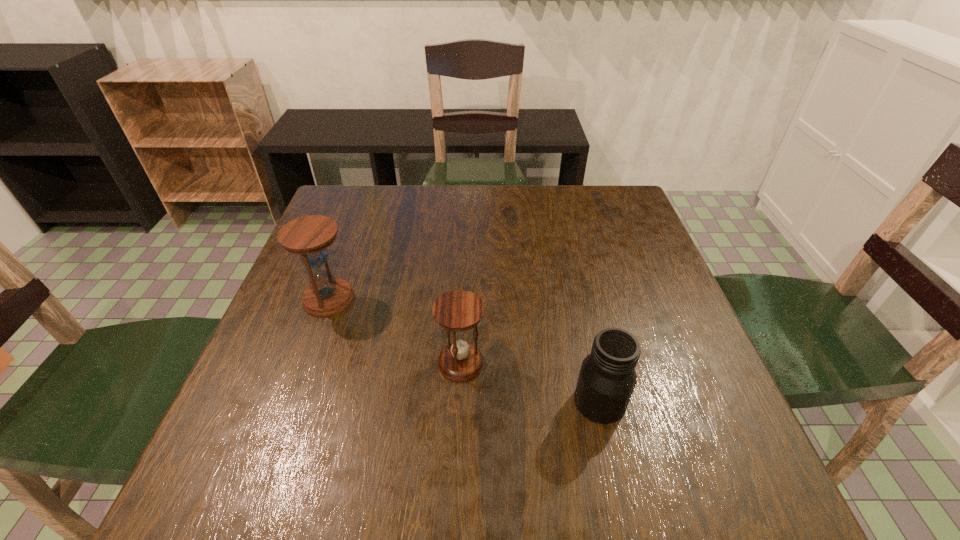
Where is `vacant space at the left edge of the desktop`? The image size is (960, 540). vacant space at the left edge of the desktop is located at coordinates (261, 353).

Locate an element on the screen. The image size is (960, 540). vacant area at the right edge of the desktop is located at coordinates (601, 278).

In the image, there is a desktop. Identify the location of free space at the far left corner. (375, 192).

At what (x,y) coordinates should I click in order to perform the action: click on free region at the far right corner of the desktop. Please return your answer as a coordinate pair (x, y). Looking at the image, I should click on coord(642,227).

At what (x,y) coordinates should I click in order to perform the action: click on unoccupied position between the second object from left to right and the farthest object. Please return your answer as a coordinate pair (x, y). The image size is (960, 540). Looking at the image, I should click on (395, 331).

This screenshot has width=960, height=540. Find the location of `free space between the second object from right to left and the farthest object`. free space between the second object from right to left and the farthest object is located at coordinates (395, 331).

Where is `unoccupied area between the leftmost object and the shorter hourglass`? Image resolution: width=960 pixels, height=540 pixels. unoccupied area between the leftmost object and the shorter hourglass is located at coordinates (395, 331).

The image size is (960, 540). What are the coordinates of `blank region between the jar and the shorter hourglass` in the screenshot? It's located at (530, 382).

I want to click on vacant space that's between the jar and the right hourglass, so click(530, 382).

At what (x,y) coordinates should I click in order to perform the action: click on vacant space in between the shorter hourglass and the leftmost object. Please return your answer as a coordinate pair (x, y). The width and height of the screenshot is (960, 540). Looking at the image, I should click on (395, 331).